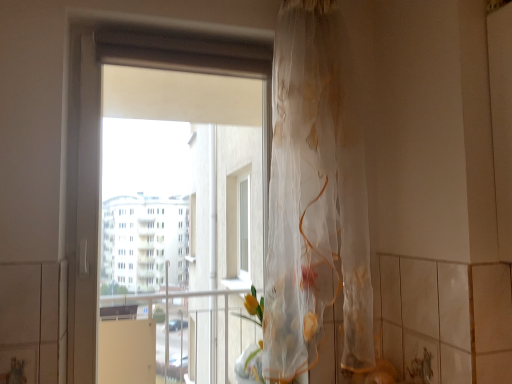
Question: Is transparent plastic window at center looking in the opposite direction of translucent floral-patterned curtain at center?

Choices:
 (A) no
 (B) yes

Answer: (A)

Question: From the image's perspective, does transparent plastic window at center appear higher than translucent floral-patterned curtain at center?

Choices:
 (A) no
 (B) yes

Answer: (A)

Question: Could translucent floral-patterned curtain at center be considered to be inside transparent plastic window at center?

Choices:
 (A) yes
 (B) no

Answer: (B)

Question: Can you confirm if transparent plastic window at center is bigger than translucent floral-patterned curtain at center?

Choices:
 (A) yes
 (B) no

Answer: (B)

Question: Is transparent plastic window at center facing towards translucent floral-patterned curtain at center?

Choices:
 (A) yes
 (B) no

Answer: (A)

Question: Considering the relative sizes of transparent plastic window at center and translucent floral-patterned curtain at center in the image provided, is transparent plastic window at center shorter than translucent floral-patterned curtain at center?

Choices:
 (A) no
 (B) yes

Answer: (A)

Question: Does translucent floral-patterned curtain at center come behind transparent plastic window at center?

Choices:
 (A) yes
 (B) no

Answer: (B)

Question: Is translucent floral-patterned curtain at center not near transparent plastic window at center?

Choices:
 (A) no
 (B) yes

Answer: (A)

Question: Is translucent floral-patterned curtain at center positioned with its back to transparent plastic window at center?

Choices:
 (A) yes
 (B) no

Answer: (B)

Question: From the image's perspective, is translucent floral-patterned curtain at center above transparent plastic window at center?

Choices:
 (A) yes
 (B) no

Answer: (A)

Question: From the image's perspective, would you say translucent floral-patterned curtain at center is shown under transparent plastic window at center?

Choices:
 (A) yes
 (B) no

Answer: (B)

Question: Is translucent floral-patterned curtain at center located outside transparent plastic window at center?

Choices:
 (A) yes
 (B) no

Answer: (A)

Question: From their relative heights in the image, would you say translucent floral-patterned curtain at center is taller or shorter than transparent plastic window at center?

Choices:
 (A) tall
 (B) short

Answer: (B)